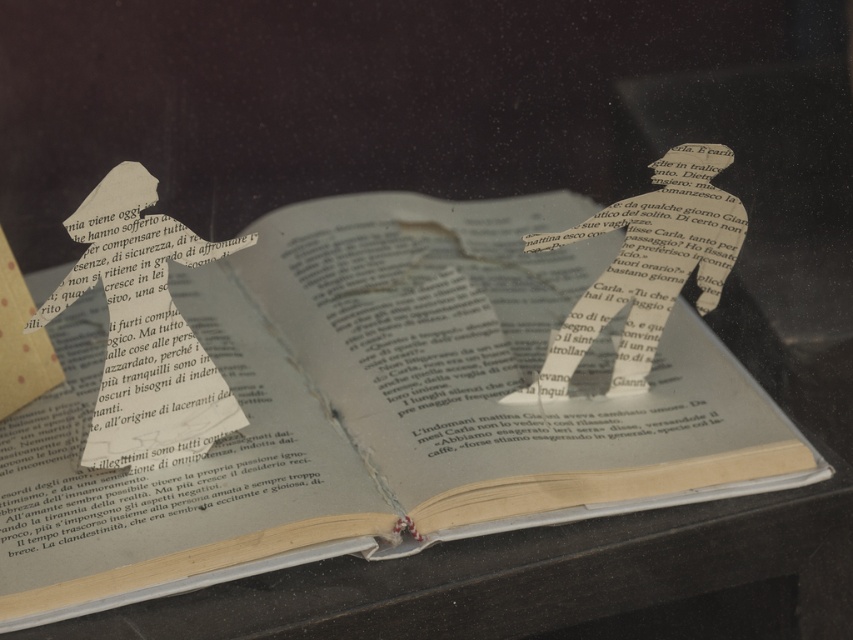
Based on the photo, you are a chef who needs to place the silvery metallic spoon at center onto the yellowed paper book at center without touching the torn paper. Is the spoon currently positioned above or below the book?

The yellowed paper book at center is below the silvery metallic spoon at center, so the spoon is currently positioned above the book.

Based on the photo, you are trying to place a small sticker exactly in the middle of the book. Considering the silhouette paper at center and the silvery metallic spoon at center, which object should you use as a reference to ensure the sticker is centered?

The silhouette paper at center has a lesser width compared to the silvery metallic spoon at center, so using the silhouette paper at center as a reference would help in placing the sticker more accurately in the center of the book since it is narrower and closer to the middle.

You are holding a magnifying glass and want to examine both the silhouette paper at center and the silvery metallic spoon at center. Which object should you focus on first to get a clearer view without moving the magnifying glass?

The silhouette paper at center is closer to the viewer than the silvery metallic spoon at center, so focusing on it first will provide a clearer view without needing to adjust the magnifying glass.